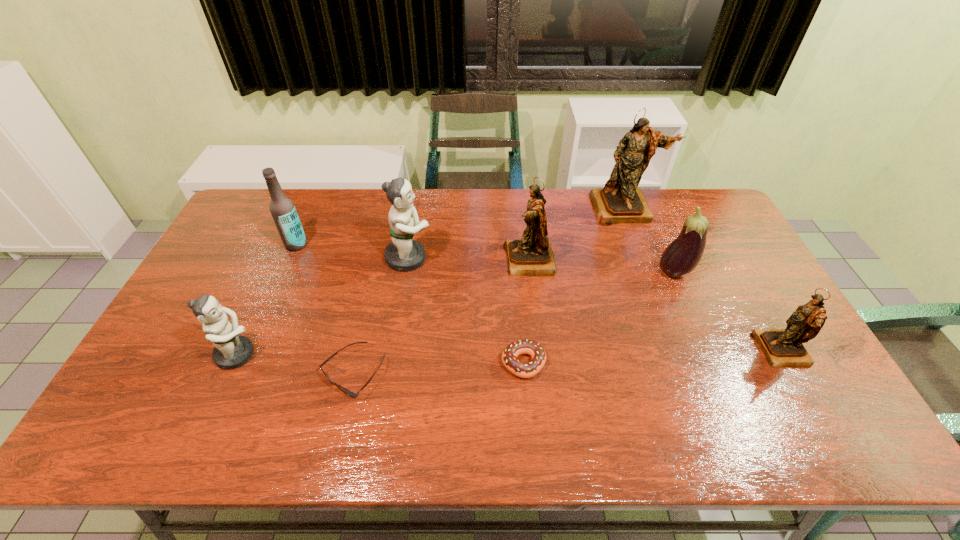
Where is `vacant space that is in between the eggplant and the smallest gold figurine`? vacant space that is in between the eggplant and the smallest gold figurine is located at coordinates (728, 312).

Where is `vacant space that is in between the right green figurine and the rightmost object`? vacant space that is in between the right green figurine and the rightmost object is located at coordinates (595, 304).

Locate an element on the screen. The height and width of the screenshot is (540, 960). vacant point located between the beer bottle and the doughnut is located at coordinates (410, 304).

Where is `the third closest object relative to the farthest figurine`? The height and width of the screenshot is (540, 960). the third closest object relative to the farthest figurine is located at coordinates 782,347.

Identify which object is the fourth closest to the right green figurine. Please provide its 2D coordinates. Your answer should be formatted as a tuple, i.e. [(x, y)], where the tuple contains the x and y coordinates of a point satisfying the conditions above.

[(519, 368)]

Select which figurine is the closest to the sunglasses. Please provide its 2D coordinates. Your answer should be formatted as a tuple, i.e. [(x, y)], where the tuple contains the x and y coordinates of a point satisfying the conditions above.

[(232, 350)]

The width and height of the screenshot is (960, 540). In order to click on figurine that stands as the fourth closest to the blue sunglasses in this screenshot , I will do `click(621, 200)`.

Find the location of a particular element. The height and width of the screenshot is (540, 960). gold figurine that is the closest to the leftmost figurine is located at coordinates (532, 255).

Identify which gold figurine is located as the nearest to the smallest gold figurine. Please provide its 2D coordinates. Your answer should be formatted as a tuple, i.e. [(x, y)], where the tuple contains the x and y coordinates of a point satisfying the conditions above.

[(621, 200)]

I want to click on free space in the image that satisfies the following two spatial constraints: 1. on the front-facing side of the farthest figurine; 2. on the front-facing side of the second nearest gold figurine, so click(x=642, y=260).